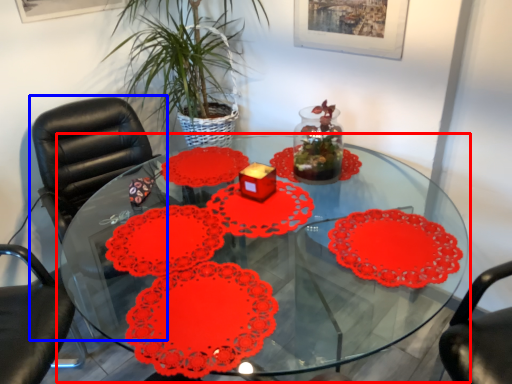
Question: Which point is further to the camera, table (highlighted by a red box) or chair (highlighted by a blue box)?

Choices:
 (A) table
 (B) chair

Answer: (B)